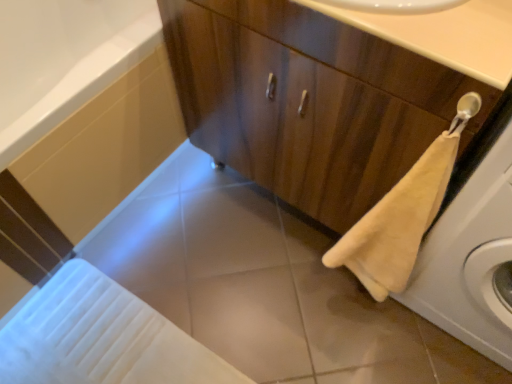
Question: Is wooden cabinet at center wider than beige fabric washing machine at right?

Choices:
 (A) yes
 (B) no

Answer: (A)

Question: Is wooden cabinet at center to the right of beige fabric washing machine at right from the viewer's perspective?

Choices:
 (A) no
 (B) yes

Answer: (A)

Question: Is wooden cabinet at center behind beige fabric washing machine at right?

Choices:
 (A) yes
 (B) no

Answer: (A)

Question: Is wooden cabinet at center touching beige fabric washing machine at right?

Choices:
 (A) no
 (B) yes

Answer: (A)

Question: Does wooden cabinet at center have a lesser width compared to beige fabric washing machine at right?

Choices:
 (A) no
 (B) yes

Answer: (A)

Question: Visually, is white glossy bath at lower left positioned to the left or to the right of beige fabric washing machine at right?

Choices:
 (A) left
 (B) right

Answer: (A)

Question: From the image's perspective, is white glossy bath at lower left positioned above or below beige fabric washing machine at right?

Choices:
 (A) above
 (B) below

Answer: (A)

Question: Considering their positions, is white glossy bath at lower left located in front of or behind beige fabric washing machine at right?

Choices:
 (A) front
 (B) behind

Answer: (B)

Question: Is point (76, 112) positioned closer to the camera than point (449, 221)?

Choices:
 (A) farther
 (B) closer

Answer: (A)

Question: From a real-world perspective, is beige plush towel at lower right physically located above or below smooth beige countertop at upper center?

Choices:
 (A) above
 (B) below

Answer: (B)

Question: In the image, is beige plush towel at lower right on the left side or the right side of smooth beige countertop at upper center?

Choices:
 (A) left
 (B) right

Answer: (B)

Question: From the image's perspective, is beige plush towel at lower right located above or below smooth beige countertop at upper center?

Choices:
 (A) below
 (B) above

Answer: (A)

Question: Considering the positions of beige plush towel at lower right and smooth beige countertop at upper center in the image, is beige plush towel at lower right taller or shorter than smooth beige countertop at upper center?

Choices:
 (A) short
 (B) tall

Answer: (B)

Question: From a real-world perspective, relative to beige fabric washing machine at right, is smooth beige countertop at upper center vertically above or below?

Choices:
 (A) above
 (B) below

Answer: (A)

Question: In terms of size, does smooth beige countertop at upper center appear bigger or smaller than beige fabric washing machine at right?

Choices:
 (A) big
 (B) small

Answer: (B)